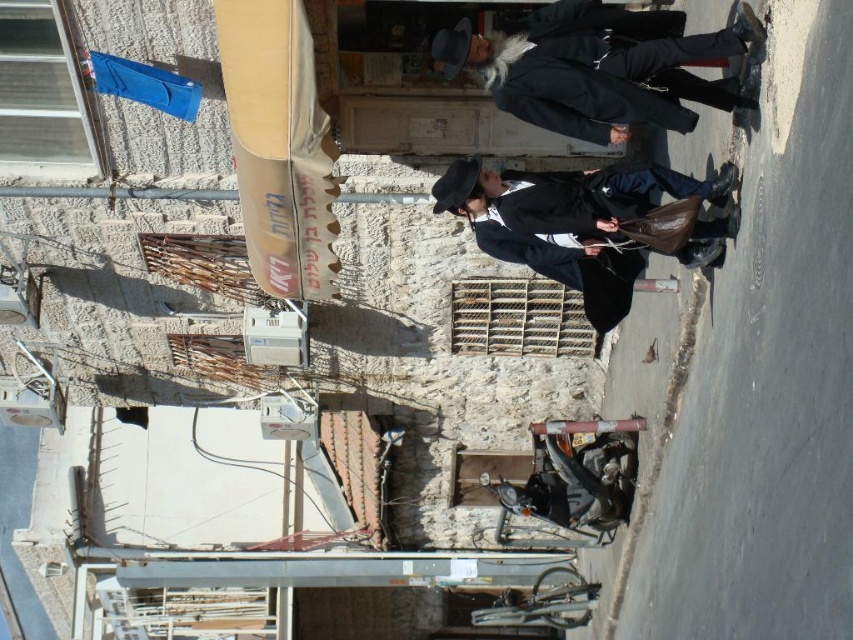
You are a photographer standing on the street and want to capture both the dark wool coat at center and the matte black coat at center in your shot. Which coat should you focus on first to ensure both are in frame?

The dark wool coat at center is located above the matte black coat at center, so focusing on the dark wool coat at center first will ensure both are within the frame.

You are a photographer trying to capture both the dark wool coat at center and the matte black coat at center in a single frame. Which coat should you position closer to the left side of your camera viewfinder to ensure both are visible?

To ensure both the dark wool coat at center and the matte black coat at center are visible in your frame, position the dark wool coat at center closer to the left side of your camera viewfinder since it is already to the left of the matte black coat at center in the scene.